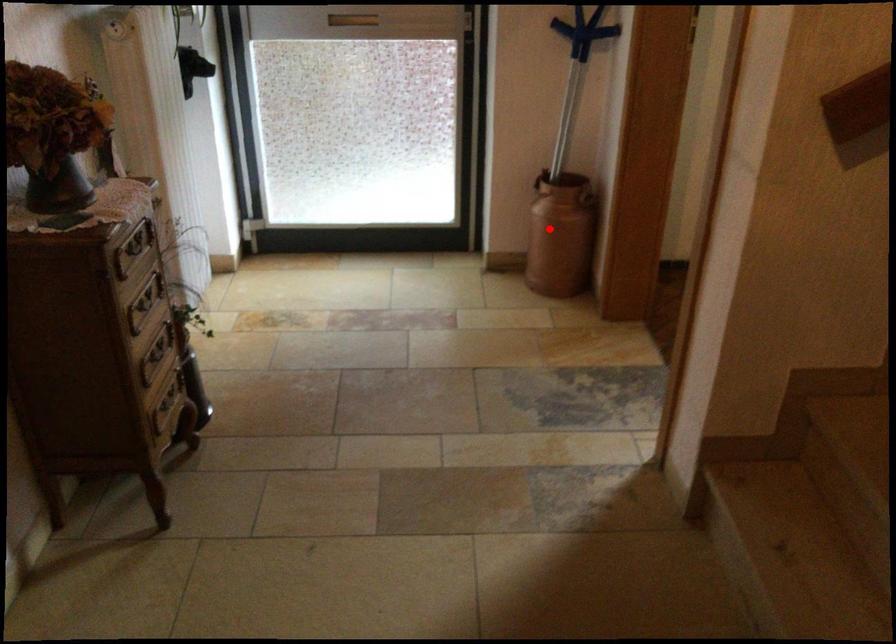
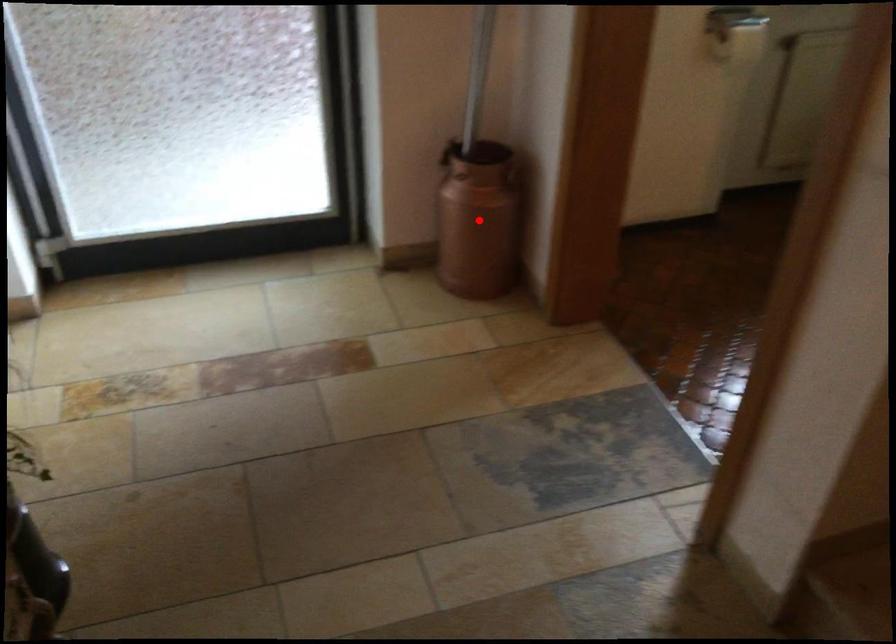
I am providing you with two images of the same scene from different viewpoints. A red point is marked on the first image and another point is marked on the second image. Is the marked point in image1 the same physical position as the marked point in image2?

Yes